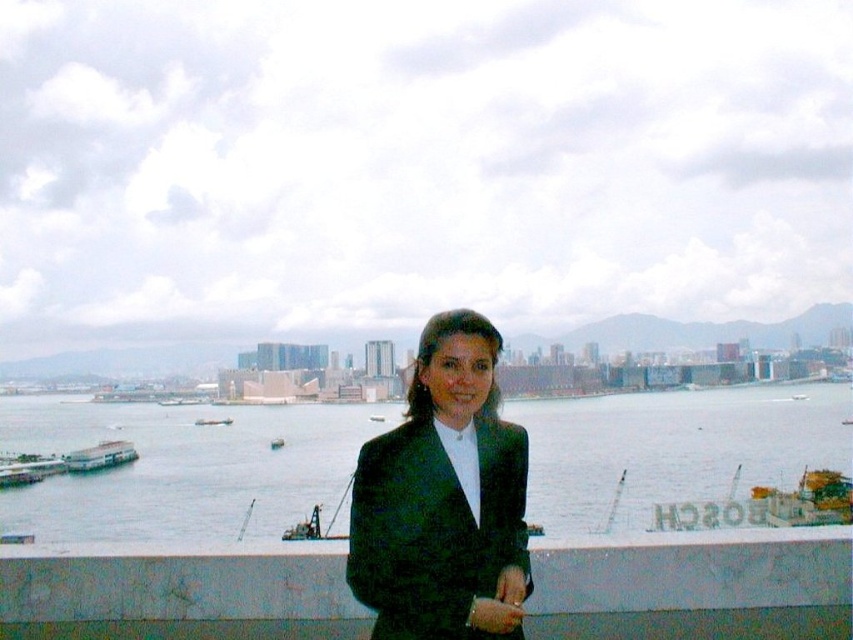
Is clear water at center above metallic gray boat at lower left?

Indeed, clear water at center is positioned over metallic gray boat at lower left.

Is clear water at center to the right of metallic gray boat at lower left from the viewer's perspective?

Correct, you'll find clear water at center to the right of metallic gray boat at lower left.

Where is `clear water at center`? The width and height of the screenshot is (853, 640). clear water at center is located at coordinates (183, 467).

Can you confirm if white marble ledge at center is thinner than teal plastic boat at center?

In fact, white marble ledge at center might be wider than teal plastic boat at center.

Is white marble ledge at center smaller than teal plastic boat at center?

No, white marble ledge at center is not smaller than teal plastic boat at center.

Describe the element at coordinates (695, 586) in the screenshot. I see `white marble ledge at center` at that location.

Identify the location of white marble ledge at center. This screenshot has height=640, width=853. (695, 586).

Is white marble ledge at center to the right of metallic gray boat at lower left from the viewer's perspective?

Indeed, white marble ledge at center is positioned on the right side of metallic gray boat at lower left.

Is point (160, 627) closer to camera compared to point (74, 451)?

Yes, it is in front of point (74, 451).

Image resolution: width=853 pixels, height=640 pixels. Find the location of `white marble ledge at center`. white marble ledge at center is located at coordinates (695, 586).